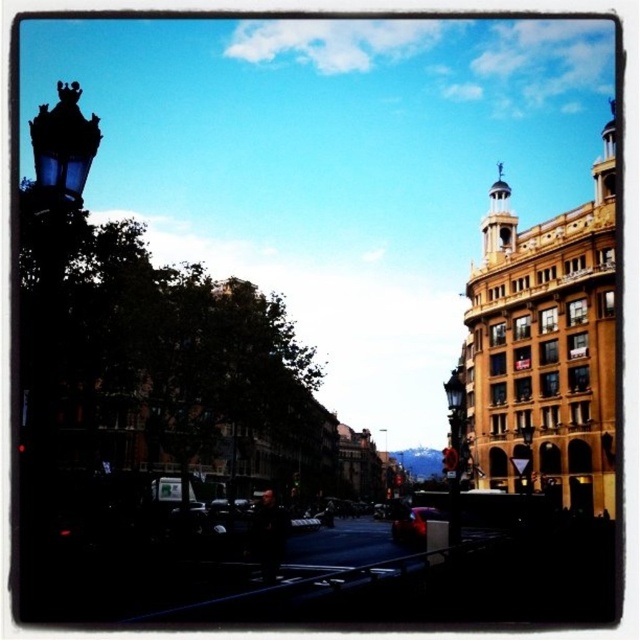
You are driving a glossy red car at center and want to park it under a metallic street light at center. Is there enough space for the car to fit under the light?

The glossy red car at center is already positioned under the metallic street light at center, so there is sufficient space for the car to fit under the light.

You are standing at a point and want to reach the multi story building on the right. The point you are currently at is labeled as point (529,486). Considering the distance between you and the building, can you estimate whether you are closer to the building or farther away than 300 feet?

The distance between point (529,486) and the viewer is 304.72 feet, so you are farther away than 300 feet from the multi story building on the right.